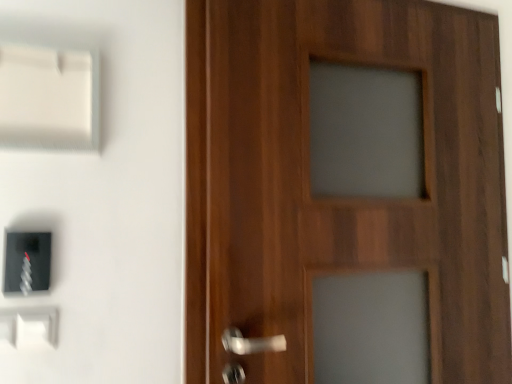
Question: Looking at their shapes, would you say white plastic light switch at lower left, the third light switch from the top, is wider or thinner than black plastic light switch at lower left, which is the 2th light switch in top-to-bottom order?

Choices:
 (A) wide
 (B) thin

Answer: (B)

Question: From the image's perspective, relative to black plastic light switch at lower left, the second light switch from the bottom, is white plastic light switch at lower left, the first light switch positioned from the bottom, above or below?

Choices:
 (A) above
 (B) below

Answer: (B)

Question: Which object is the farthest from the white plastic light switch at lower left, the third light switch from the top?

Choices:
 (A) white plastic light switch at upper left, the third light switch when ordered from bottom to top
 (B) wooden door at right
 (C) black plastic light switch at lower left, the second light switch from the bottom

Answer: (B)

Question: Based on their relative distances, which object is nearer to the white plastic light switch at upper left, the first light switch in the top-to-bottom sequence?

Choices:
 (A) white plastic light switch at lower left, the first light switch positioned from the bottom
 (B) black plastic light switch at lower left, which is the 2th light switch in top-to-bottom order
 (C) wooden door at right

Answer: (B)